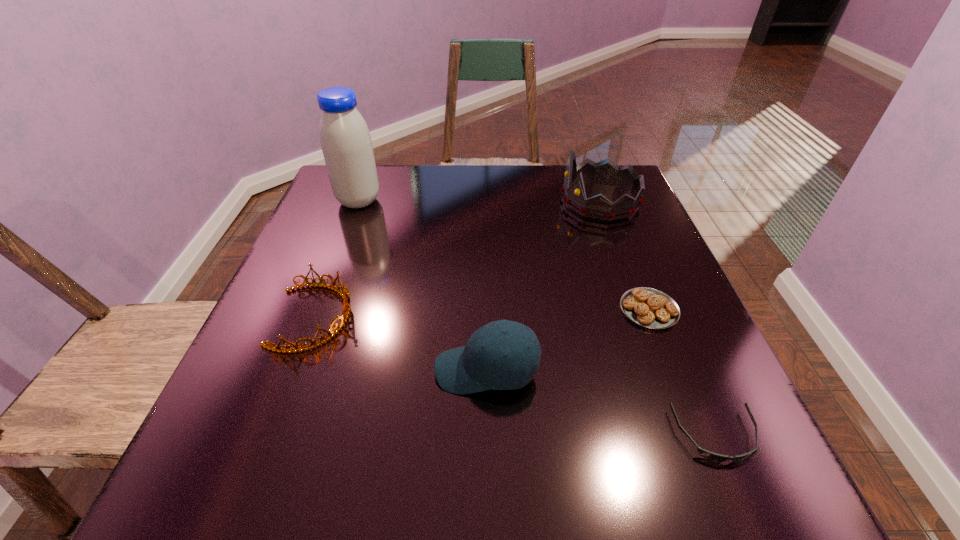
Find the location of a particular element. This screenshot has width=960, height=540. soya milk is located at coordinates (345, 139).

At what (x,y) coordinates should I click in order to perform the action: click on the taller tiara. Please return your answer as a coordinate pair (x, y). Looking at the image, I should click on (607, 172).

Find the location of a particular element. the farther tiara is located at coordinates (607, 172).

This screenshot has height=540, width=960. Identify the location of baseball cap. (480, 365).

Where is `the fourth shortest object`? the fourth shortest object is located at coordinates (480, 365).

Where is `the nearer tiara`? The width and height of the screenshot is (960, 540). the nearer tiara is located at coordinates (344, 293).

At what (x,y) coordinates should I click in order to perform the action: click on the left tiara. Please return your answer as a coordinate pair (x, y). Looking at the image, I should click on (344, 293).

Where is `the second shortest object`? The image size is (960, 540). the second shortest object is located at coordinates (648, 307).

This screenshot has width=960, height=540. In order to click on sunglasses in this screenshot , I will do `click(711, 456)`.

Where is `the nearest object`? This screenshot has height=540, width=960. the nearest object is located at coordinates (711, 456).